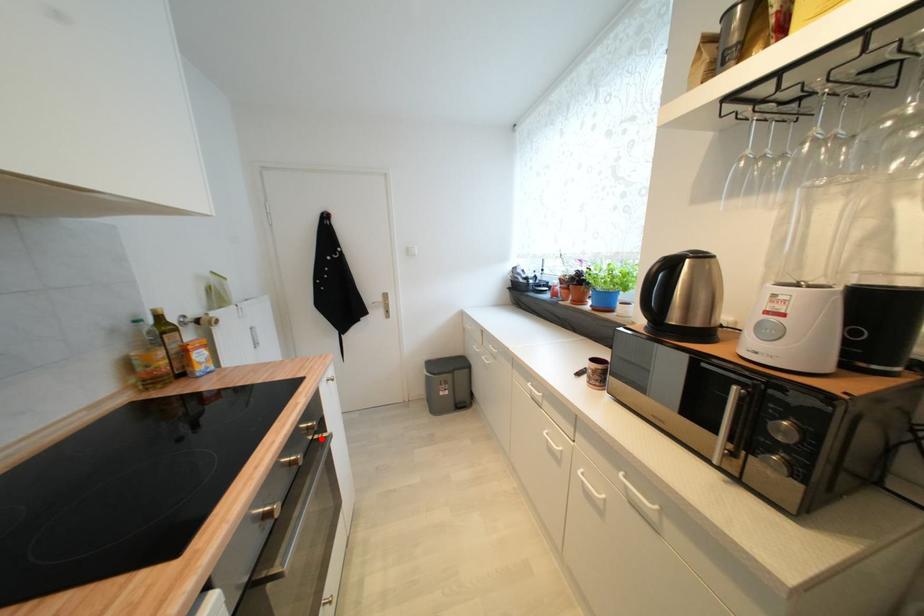
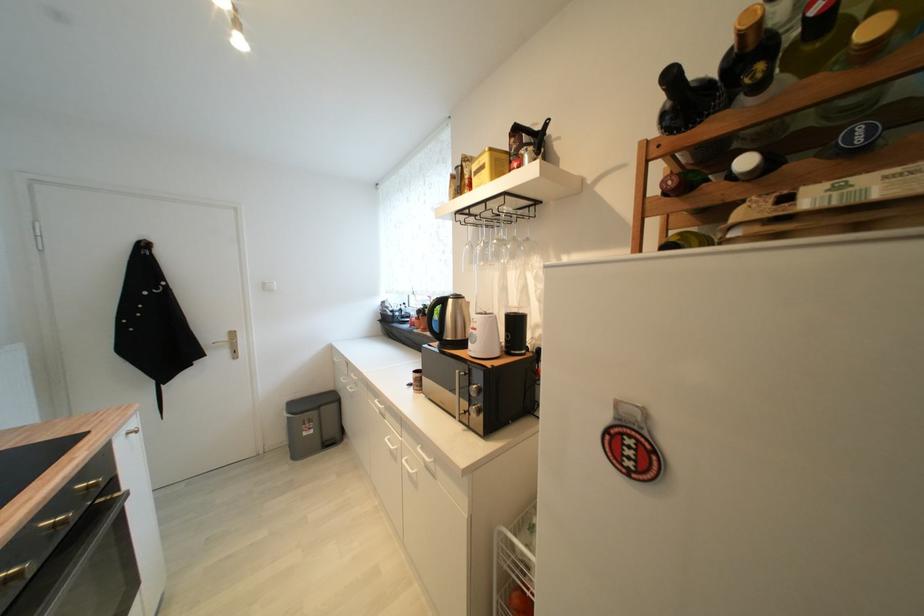
Question: I am providing you with two images of the same scene from different viewpoints. A red point is shown in image1. For the corresponding object point in image2, is it positioned nearer or farther from the camera?

Choices:
 (A) Nearer
 (B) Farther

Answer: (B)